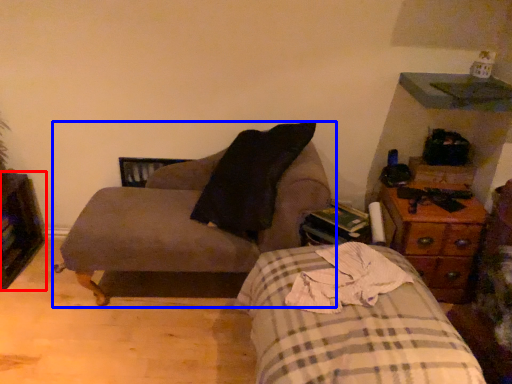
Question: Which point is further to the camera, dresser (highlighted by a red box) or chair (highlighted by a blue box)?

Choices:
 (A) dresser
 (B) chair

Answer: (A)